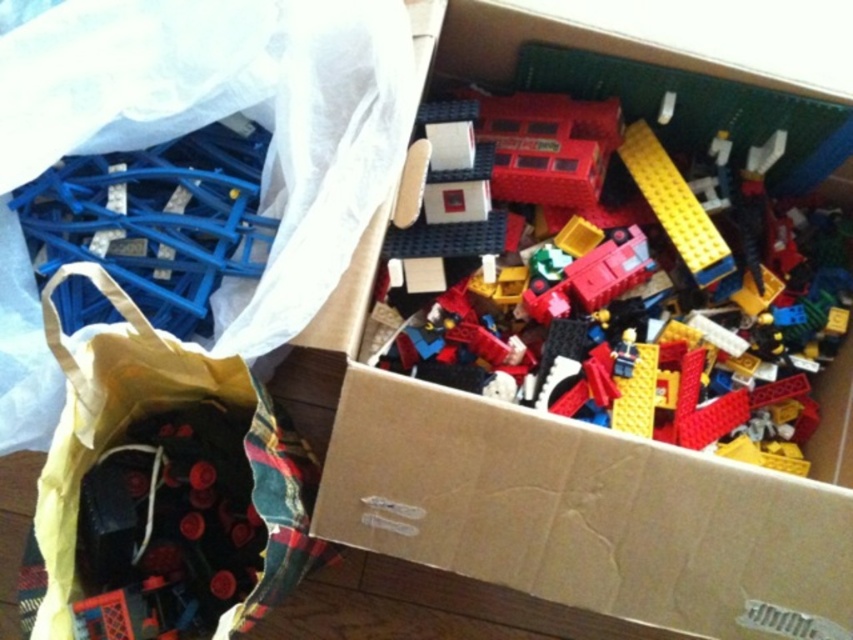
Does cardboard box at upper center appear over black fabric bag at lower left?

Correct, cardboard box at upper center is located above black fabric bag at lower left.

Between cardboard box at upper center and black fabric bag at lower left, which one appears on the left side from the viewer's perspective?

black fabric bag at lower left

Who is more distant from viewer, (834, 413) or (44, 504)?

The point (834, 413) is behind.

Identify the location of cardboard box at upper center. (543, 509).